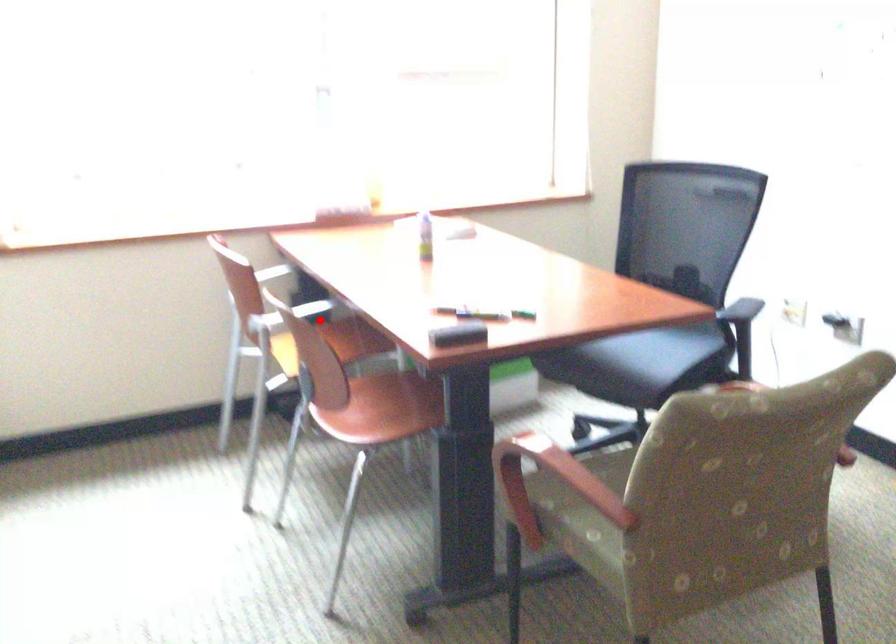
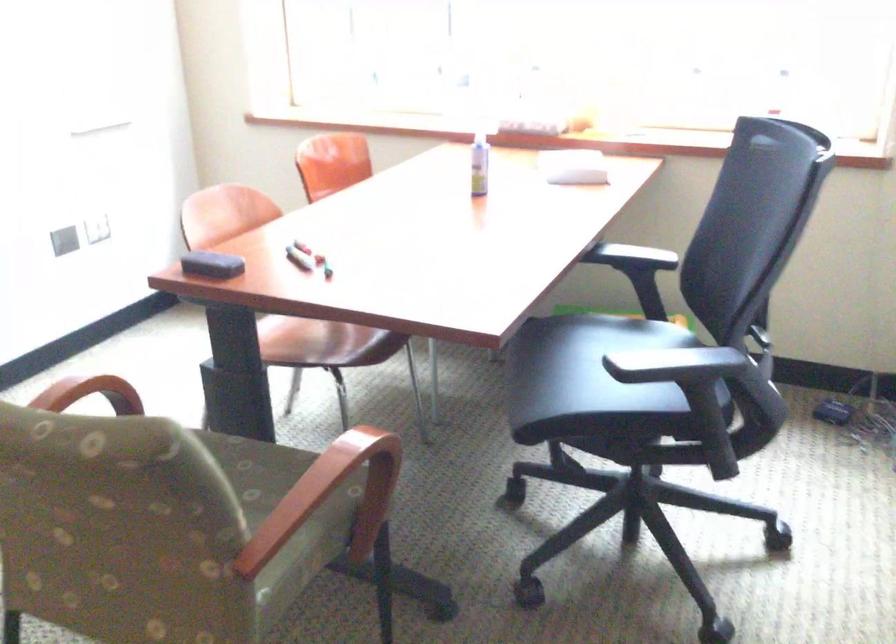
Question: I am providing you with two images of the same scene from different viewpoints. A red point is marked on the first image. Is the red point's position out of view in image 2?

Choices:
 (A) Yes
 (B) No

Answer: (A)